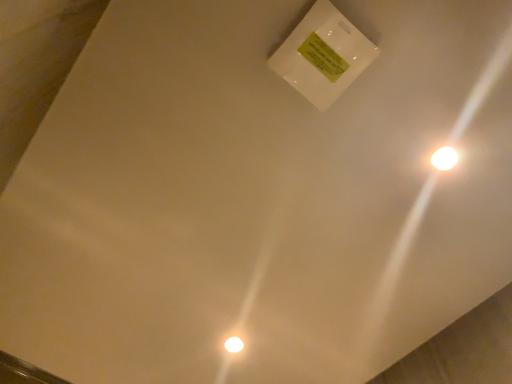
Question: Is white glossy light bulb at lower center inside white glossy light at upper right?

Choices:
 (A) yes
 (B) no

Answer: (B)

Question: Is white glossy light at upper right further to the viewer compared to white glossy light bulb at lower center?

Choices:
 (A) yes
 (B) no

Answer: (B)

Question: From the image's perspective, is white glossy light at upper right under white glossy light bulb at lower center?

Choices:
 (A) no
 (B) yes

Answer: (A)

Question: Is white glossy light at upper right looking in the opposite direction of white glossy light bulb at lower center?

Choices:
 (A) yes
 (B) no

Answer: (B)

Question: Can you confirm if white glossy light at upper right is positioned to the right of white glossy light bulb at lower center?

Choices:
 (A) yes
 (B) no

Answer: (A)

Question: Can you confirm if white glossy light at upper right is wider than white glossy light bulb at lower center?

Choices:
 (A) no
 (B) yes

Answer: (A)

Question: Can you confirm if white glossy light bulb at lower center is taller than white glossy light at upper right?

Choices:
 (A) no
 (B) yes

Answer: (B)

Question: Could white glossy light at upper right be considered to be inside white glossy light bulb at lower center?

Choices:
 (A) yes
 (B) no

Answer: (B)

Question: Considering the relative positions of white glossy light bulb at lower center and white glossy light at upper right in the image provided, is white glossy light bulb at lower center to the left of white glossy light at upper right from the viewer's perspective?

Choices:
 (A) no
 (B) yes

Answer: (B)

Question: From the image's perspective, is white glossy light bulb at lower center above white glossy light at upper right?

Choices:
 (A) yes
 (B) no

Answer: (B)

Question: Is white glossy light bulb at lower center facing away from white glossy light at upper right?

Choices:
 (A) no
 (B) yes

Answer: (A)

Question: Can you confirm if white glossy light bulb at lower center is bigger than white glossy light at upper right?

Choices:
 (A) no
 (B) yes

Answer: (B)

Question: Is white glossy light at upper right bigger or smaller than white glossy light bulb at lower center?

Choices:
 (A) big
 (B) small

Answer: (B)